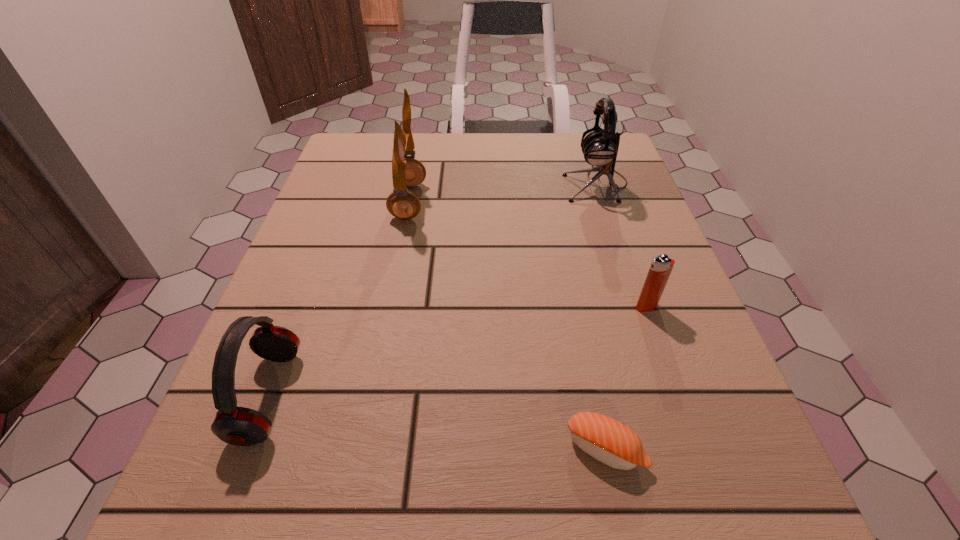
The height and width of the screenshot is (540, 960). Find the location of `vacant space that satisfies the following two spatial constraints: 1. on the front-facing side of the shortest object; 2. on the left side of the second object from left to right`. vacant space that satisfies the following two spatial constraints: 1. on the front-facing side of the shortest object; 2. on the left side of the second object from left to right is located at coordinates (361, 449).